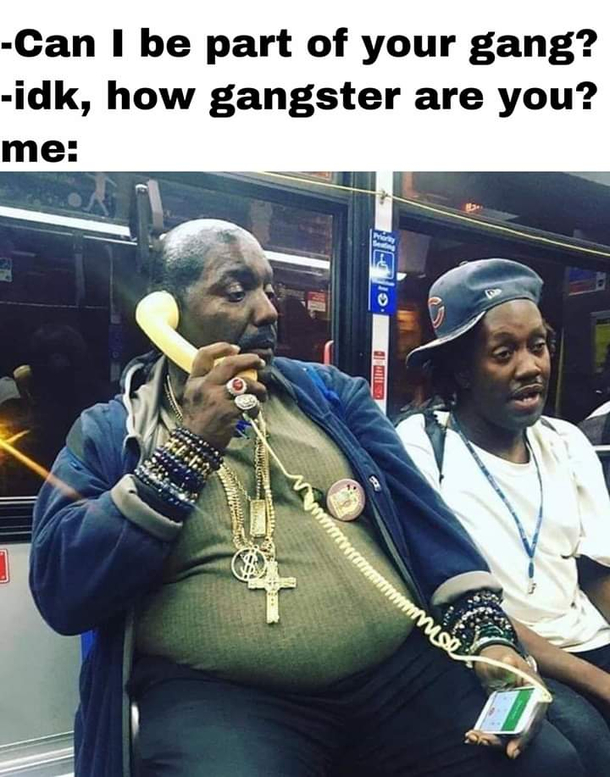
You are a GUI agent. You are given a task and a screenshot of the screen. Output one action in this format:
    pyautogui.click(x=<x>, y=<y>)
    Task: Click on the landline phone handset
    Image resolution: width=610 pixels, height=777 pixels.
    Given the screenshot: What is the action you would take?
    pyautogui.click(x=149, y=309), pyautogui.click(x=176, y=349)